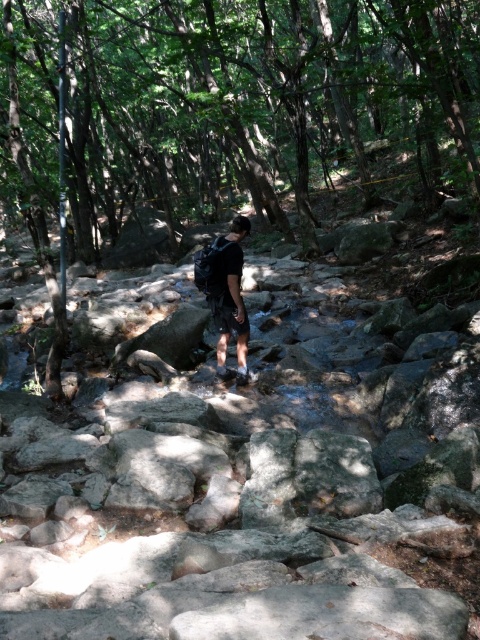
Question: Can you confirm if green leafy tree at center is bigger than dark gray backpack at center?

Choices:
 (A) yes
 (B) no

Answer: (A)

Question: Is green leafy tree at center wider than dark gray backpack at center?

Choices:
 (A) yes
 (B) no

Answer: (A)

Question: Which point appears farthest from the camera in this image?

Choices:
 (A) coord(248,227)
 (B) coord(471,76)

Answer: (B)

Question: Which point appears farthest from the camera in this image?

Choices:
 (A) (228, 284)
 (B) (66, 333)

Answer: (B)

Question: Is green leafy tree at center to the right of dark gray backpack at center from the viewer's perspective?

Choices:
 (A) yes
 (B) no

Answer: (B)

Question: Which object appears farthest from the camera in this image?

Choices:
 (A) dark gray backpack at center
 (B) green leafy tree at center

Answer: (B)